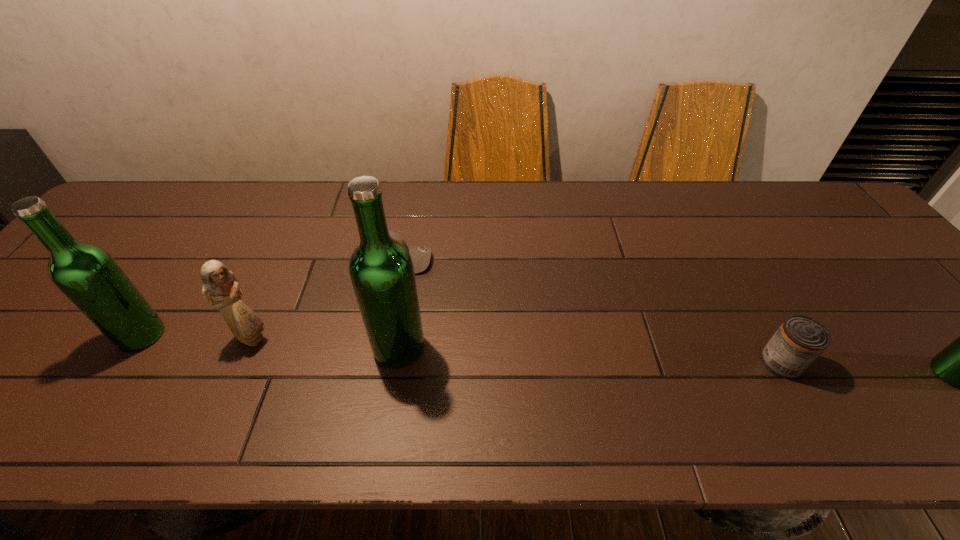
This screenshot has height=540, width=960. Find the location of `the leftmost object`. the leftmost object is located at coordinates (87, 275).

You are a GUI agent. You are given a task and a screenshot of the screen. Output one action in this format:
    pyautogui.click(x=<x>, y=<y>)
    Task: Click on the leftmost beer bottle
    
    Given the screenshot: What is the action you would take?
    pyautogui.click(x=87, y=275)

Locate an element on the screen. This screenshot has height=540, width=960. the second beer bottle from right to left is located at coordinates (381, 270).

I want to click on the fourth tallest object, so click(x=221, y=290).

Find the location of a particular element. This screenshot has width=960, height=540. the second object from left to right is located at coordinates (221, 290).

Where is `the shortest object`? Image resolution: width=960 pixels, height=540 pixels. the shortest object is located at coordinates (421, 255).

Locate an element on the screen. Image resolution: width=960 pixels, height=540 pixels. the farthest object is located at coordinates (421, 255).

At what (x,y) coordinates should I click in order to perform the action: click on can. Please return your answer as a coordinate pair (x, y). Image resolution: width=960 pixels, height=540 pixels. Looking at the image, I should click on [800, 340].

Image resolution: width=960 pixels, height=540 pixels. What are the coordinates of `vacant space located 0.330m on the back of the fifth shortest object` in the screenshot? It's located at (211, 229).

The height and width of the screenshot is (540, 960). In order to click on vacant space situated 0.130m on the back of the second beer bottle from left to right in this screenshot , I will do `click(408, 286)`.